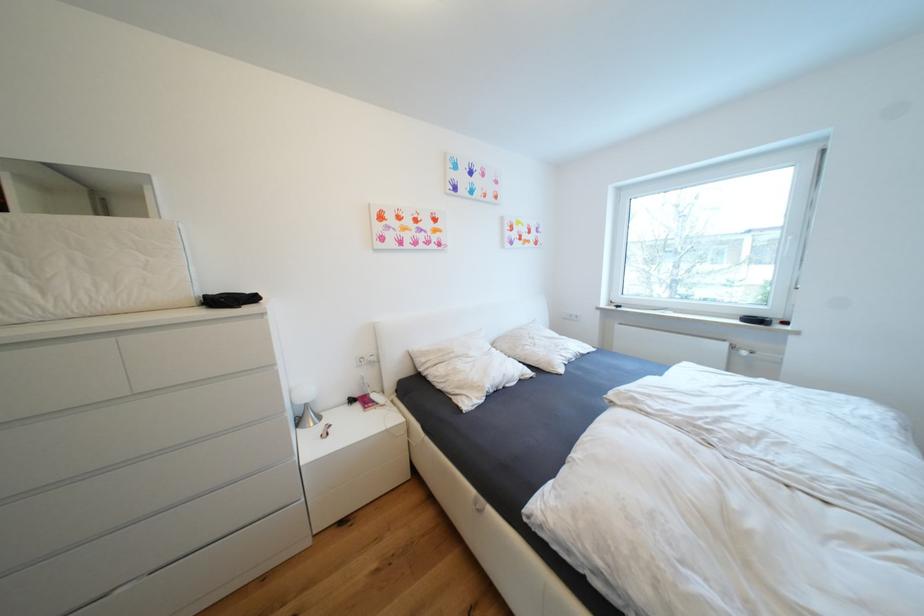
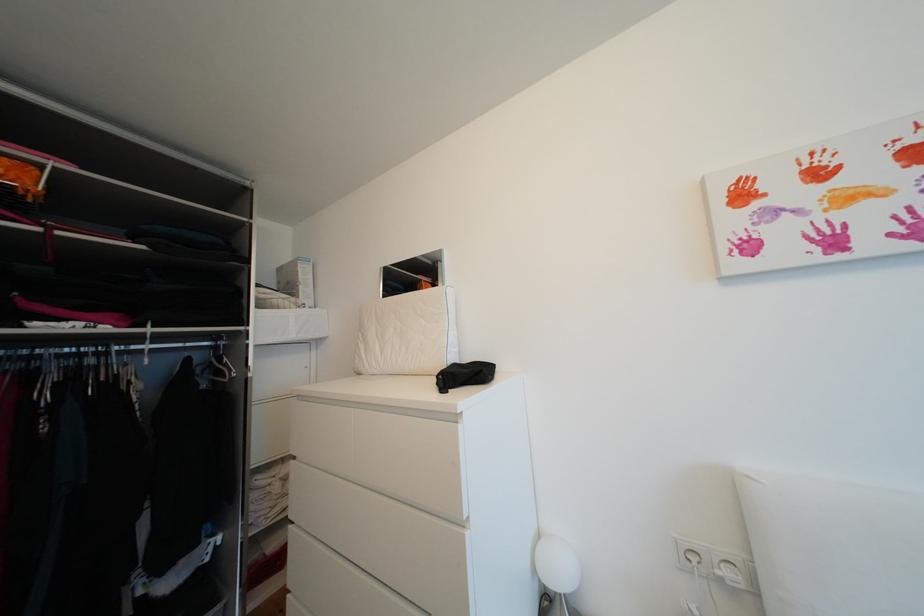
In the second image, find the point that corresponds to point 222,294 in the first image.

(473, 362)